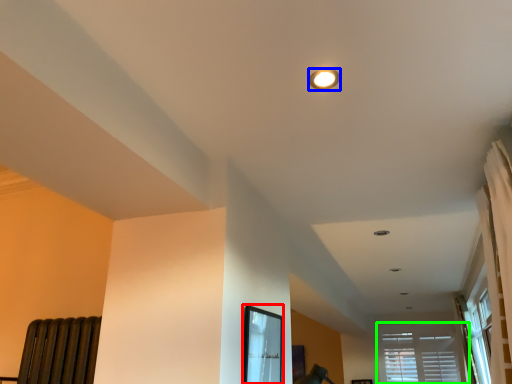
Question: Which object is the farthest from bay window (highlighted by a red box)? Choose among these: lighting (highlighted by a blue box) or window (highlighted by a green box).

Choices:
 (A) lighting
 (B) window

Answer: (B)